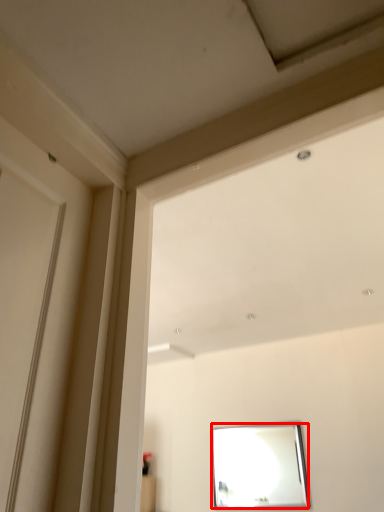
Question: From the image's perspective, where is mirror (annotated by the red box) located in relation to window frame in the image?

Choices:
 (A) below
 (B) above

Answer: (A)